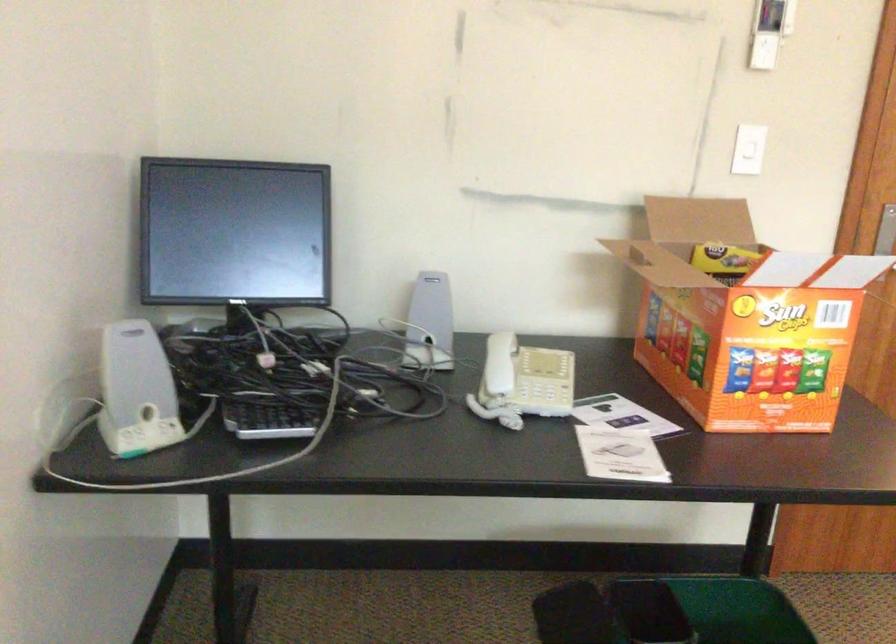
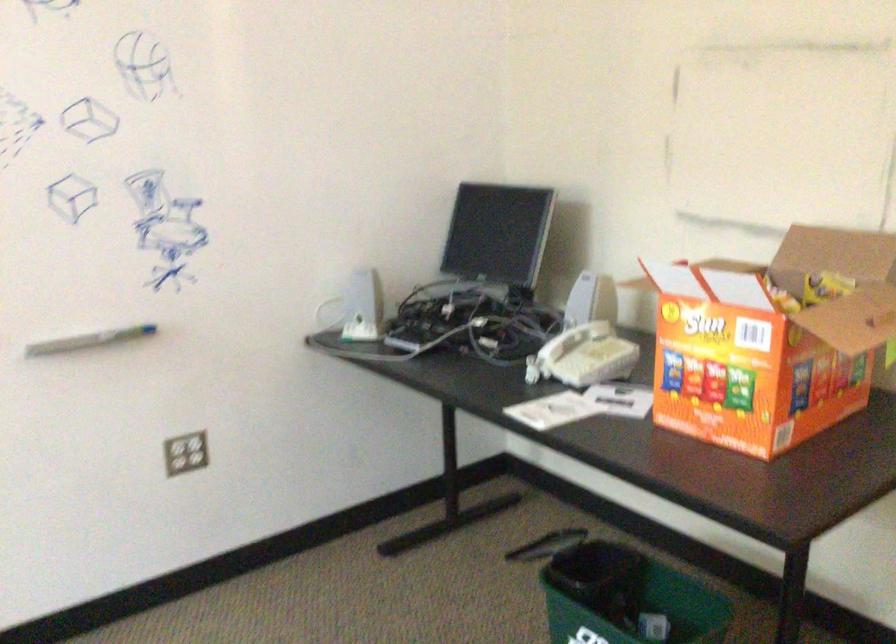
Locate, in the second image, the point that corresponds to pixel 507 373 in the first image.

(558, 345)